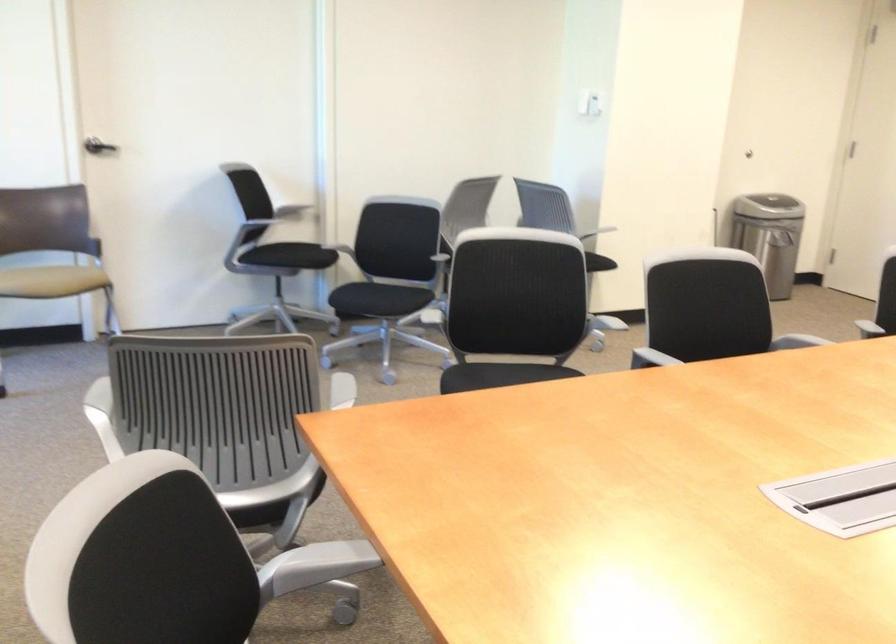
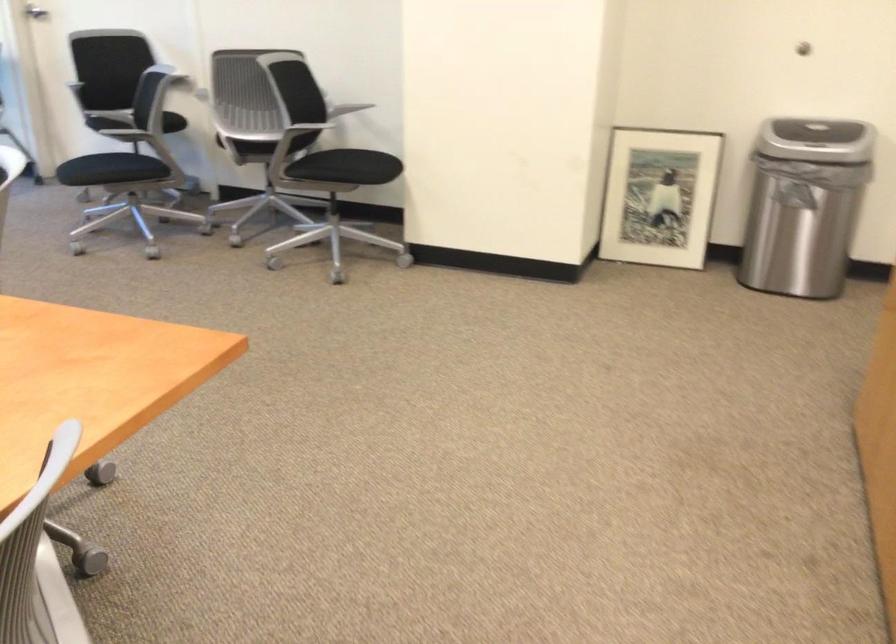
Question: I am providing you with two images of the same scene from different viewpoints. Please identify which objects are invisible in image2.

Choices:
 (A) metal trash can
 (B) trash can lid
 (C) chair sitting surface
 (D) large plastic bottle

Answer: (A)